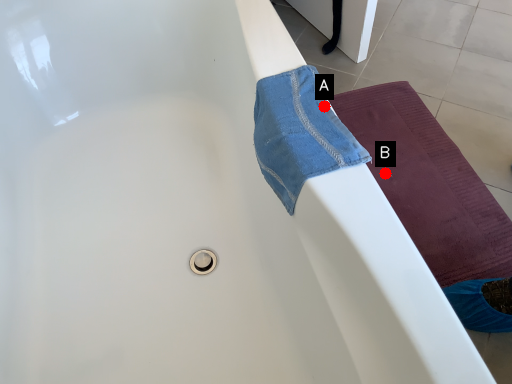
Question: Two points are circled on the image, labeled by A and B beside each circle. Which point is closer to the camera?

Choices:
 (A) A is closer
 (B) B is closer

Answer: (A)